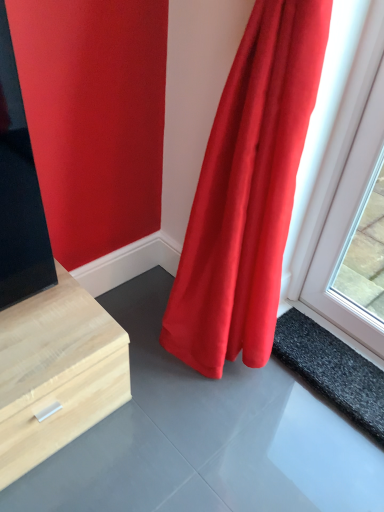
Question: Is black rubber mat at lower right to the left or to the right of matte red curtain at right in the image?

Choices:
 (A) right
 (B) left

Answer: (A)

Question: Relative to matte red curtain at right, is black rubber mat at lower right in front or behind?

Choices:
 (A) front
 (B) behind

Answer: (B)

Question: Does point (360, 376) appear closer or farther from the camera than point (253, 31)?

Choices:
 (A) closer
 (B) farther

Answer: (B)

Question: Is point (271, 162) closer or farther from the camera than point (294, 357)?

Choices:
 (A) closer
 (B) farther

Answer: (A)

Question: Do you think matte red curtain at right is within black rubber mat at lower right, or outside of it?

Choices:
 (A) outside
 (B) inside

Answer: (A)

Question: In terms of width, does matte red curtain at right look wider or thinner when compared to black rubber mat at lower right?

Choices:
 (A) wide
 (B) thin

Answer: (A)

Question: In terms of height, does matte red curtain at right look taller or shorter compared to black rubber mat at lower right?

Choices:
 (A) short
 (B) tall

Answer: (B)